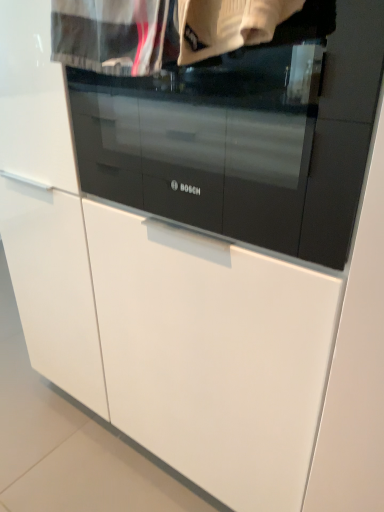
Question: In which direction should I rotate to look at white knitted sweater at upper center, positioned as the 2th clothing in left-to-right order?

Choices:
 (A) right
 (B) left

Answer: (A)

Question: Can you confirm if white knitted sweater at upper center, positioned as the 2th clothing in left-to-right order, is shorter than black glass oven at center?

Choices:
 (A) no
 (B) yes

Answer: (B)

Question: Does white knitted sweater at upper center, positioned as the 2th clothing in left-to-right order, have a smaller size compared to black glass oven at center?

Choices:
 (A) no
 (B) yes

Answer: (B)

Question: Does white knitted sweater at upper center, positioned as the 2th clothing in left-to-right order, touch black glass oven at center?

Choices:
 (A) yes
 (B) no

Answer: (B)

Question: Does white knitted sweater at upper center, positioned as the 2th clothing in left-to-right order, turn towards black glass oven at center?

Choices:
 (A) yes
 (B) no

Answer: (B)

Question: Does white knitted sweater at upper center, positioned as the 1th clothing in right-to-left order, have a greater height compared to black glass oven at center?

Choices:
 (A) yes
 (B) no

Answer: (B)

Question: Would you say black glass oven at center is part of white knitted sweater at upper center, positioned as the 2th clothing in left-to-right order,'s contents?

Choices:
 (A) no
 (B) yes

Answer: (A)

Question: From the image's perspective, is white cotton shirt at upper center, the first clothing positioned from the left, located beneath black glass oven at center?

Choices:
 (A) no
 (B) yes

Answer: (A)

Question: Could you tell me if white cotton shirt at upper center, the 2th clothing positioned from the right, is facing black glass oven at center?

Choices:
 (A) no
 (B) yes

Answer: (A)

Question: Does white cotton shirt at upper center, the 2th clothing positioned from the right, have a lesser width compared to black glass oven at center?

Choices:
 (A) yes
 (B) no

Answer: (A)

Question: Is white cotton shirt at upper center, the 2th clothing positioned from the right, to the right of black glass oven at center from the viewer's perspective?

Choices:
 (A) no
 (B) yes

Answer: (A)

Question: Does white cotton shirt at upper center, the first clothing positioned from the left, appear on the left side of black glass oven at center?

Choices:
 (A) yes
 (B) no

Answer: (A)

Question: From the image's perspective, would you say white cotton shirt at upper center, the 2th clothing positioned from the right, is positioned over black glass oven at center?

Choices:
 (A) yes
 (B) no

Answer: (A)

Question: Considering the relative sizes of black glass oven at center and white cotton shirt at upper center, the first clothing positioned from the left, in the image provided, is black glass oven at center thinner than white cotton shirt at upper center, the first clothing positioned from the left,?

Choices:
 (A) yes
 (B) no

Answer: (B)